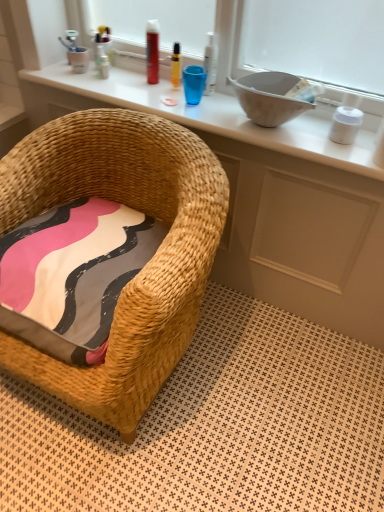
Find the location of a particular element. vacant space that is to the left of white plastic bottle at upper center, the 2th toiletry when ordered from right to left is located at coordinates (157, 95).